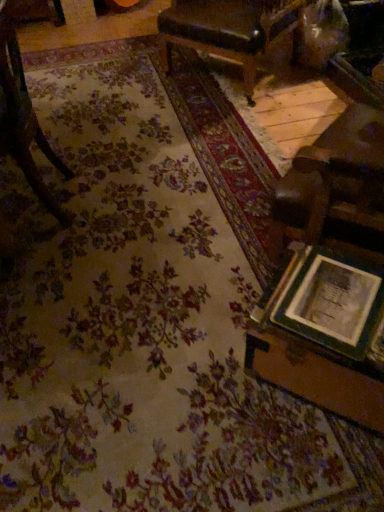
Question: Considering the relative positions of wooden chair at left, the 1th chair in the left-to-right sequence, and wooden picture frame at lower right in the image provided, is wooden chair at left, the 1th chair in the left-to-right sequence, to the left of wooden picture frame at lower right from the viewer's perspective?

Choices:
 (A) yes
 (B) no

Answer: (A)

Question: From the image's perspective, is wooden chair at left, marked as the second chair in a back-to-front arrangement, below wooden picture frame at lower right?

Choices:
 (A) yes
 (B) no

Answer: (B)

Question: Considering the relative sizes of wooden chair at left, the 2th chair in the top-to-bottom sequence, and wooden picture frame at lower right in the image provided, is wooden chair at left, the 2th chair in the top-to-bottom sequence, smaller than wooden picture frame at lower right?

Choices:
 (A) yes
 (B) no

Answer: (B)

Question: Can wooden picture frame at lower right be found inside wooden chair at left, marked as the second chair in a back-to-front arrangement?

Choices:
 (A) no
 (B) yes

Answer: (A)

Question: Is wooden chair at left, which is the 1th chair in bottom-to-top order, bigger than wooden picture frame at lower right?

Choices:
 (A) yes
 (B) no

Answer: (A)

Question: Does point (18, 124) appear closer or farther from the camera than point (195, 26)?

Choices:
 (A) farther
 (B) closer

Answer: (B)

Question: Would you say wooden chair at left, the 2th chair in the top-to-bottom sequence, is to the left or to the right of leather-like brown chair at upper center, acting as the 1th chair starting from the top, in the picture?

Choices:
 (A) right
 (B) left

Answer: (B)

Question: From the image's perspective, is wooden chair at left, the 2th chair in the top-to-bottom sequence, positioned above or below leather-like brown chair at upper center, acting as the 1th chair starting from the top?

Choices:
 (A) above
 (B) below

Answer: (B)

Question: From a real-world perspective, is wooden chair at left, marked as the second chair in a back-to-front arrangement, above or below leather-like brown chair at upper center, which is the 1th chair from back to front?

Choices:
 (A) above
 (B) below

Answer: (A)

Question: Do you think leather-like brown chair at upper center, acting as the 2th chair starting from the front, is within wooden chair at left, marked as the first chair in a front-to-back arrangement, or outside of it?

Choices:
 (A) inside
 (B) outside

Answer: (B)

Question: From the image's perspective, is leather-like brown chair at upper center, positioned as the 2th chair in left-to-right order, located above or below wooden chair at left, the 1th chair in the left-to-right sequence?

Choices:
 (A) below
 (B) above

Answer: (B)

Question: Is leather-like brown chair at upper center, positioned as the 2th chair in left-to-right order, wider or thinner than wooden chair at left, marked as the first chair in a front-to-back arrangement?

Choices:
 (A) wide
 (B) thin

Answer: (A)

Question: Is leather-like brown chair at upper center, positioned as the 1th chair in right-to-left order, in front of or behind wooden chair at left, marked as the 2th chair in a right-to-left arrangement, in the image?

Choices:
 (A) front
 (B) behind

Answer: (B)

Question: Is wooden table at lower right inside the boundaries of leather-like brown chair at upper center, acting as the 2th chair starting from the front, or outside?

Choices:
 (A) inside
 (B) outside

Answer: (B)

Question: From a real-world perspective, is wooden table at lower right physically located above or below leather-like brown chair at upper center, positioned as the 1th chair in right-to-left order?

Choices:
 (A) above
 (B) below

Answer: (B)